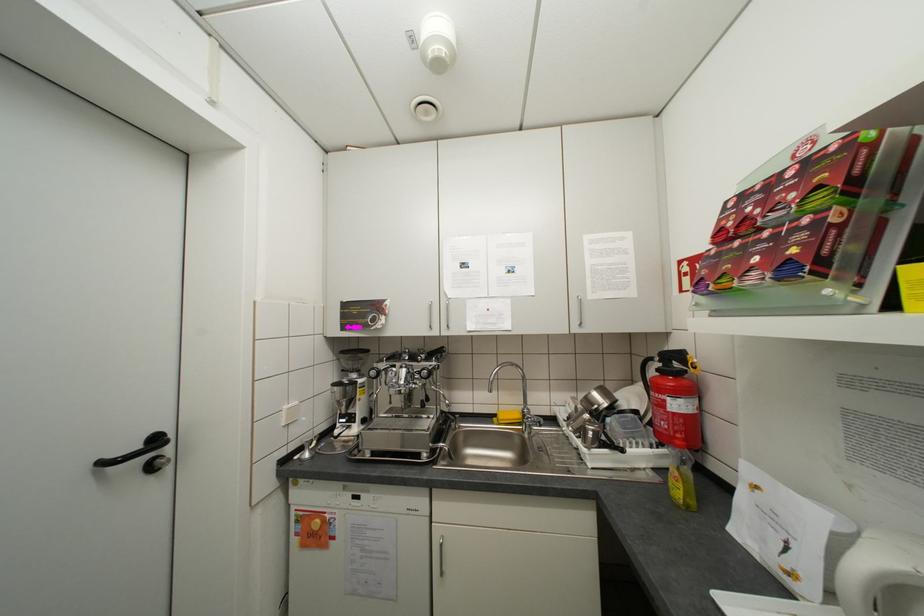
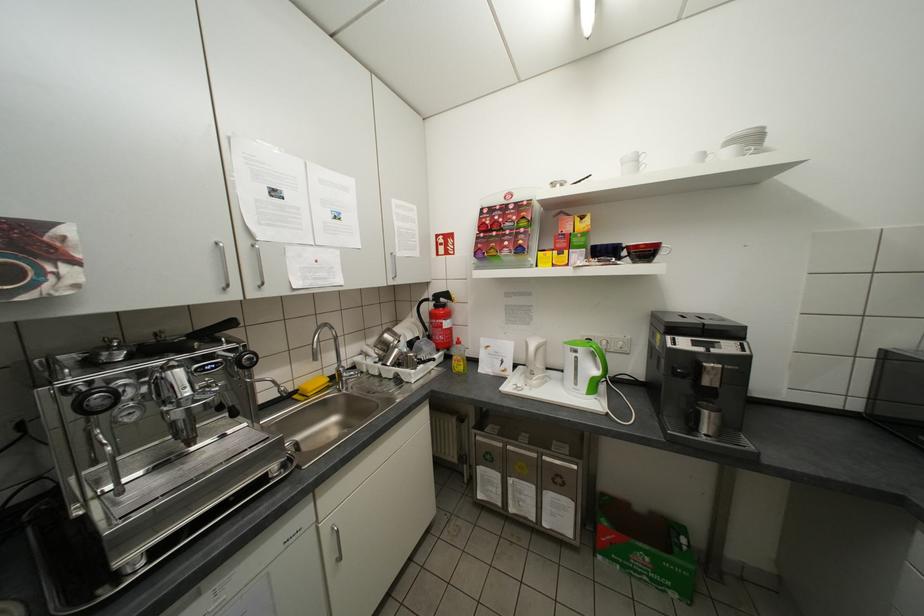
The point at (509, 418) is marked in the first image. Where is the corresponding point in the second image?

(319, 389)